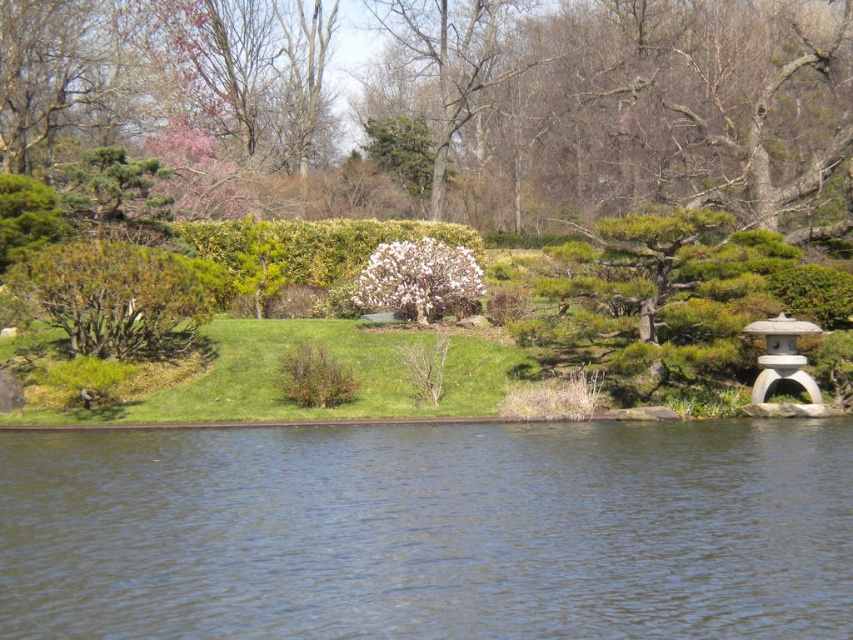
Question: Can you confirm if green textured hedge at center is smaller than white fluffy bush at center?

Choices:
 (A) no
 (B) yes

Answer: (A)

Question: Can you confirm if green leafy bush at upper center is positioned below brown textured bush at center?

Choices:
 (A) yes
 (B) no

Answer: (B)

Question: Which object is positioned closest to the green leafy bush at left?

Choices:
 (A) white fluffy bush at center
 (B) green textured hedge at center

Answer: (A)

Question: Is the position of green leafy bush at left less distant than that of white fluffy bush at center?

Choices:
 (A) yes
 (B) no

Answer: (A)

Question: Estimate the real-world distances between objects in this image. Which object is farther from the green textured hedge at center?

Choices:
 (A) brown textured bush at center
 (B) white fluffy bush at center
 (C) green leafy bush at upper center
 (D) clear water at lower center

Answer: (D)

Question: Which object is farther from the camera taking this photo?

Choices:
 (A) green leafy bush at upper center
 (B) white fluffy bush at center
 (C) brown textured bush at center
 (D) green leafy bush at left

Answer: (A)